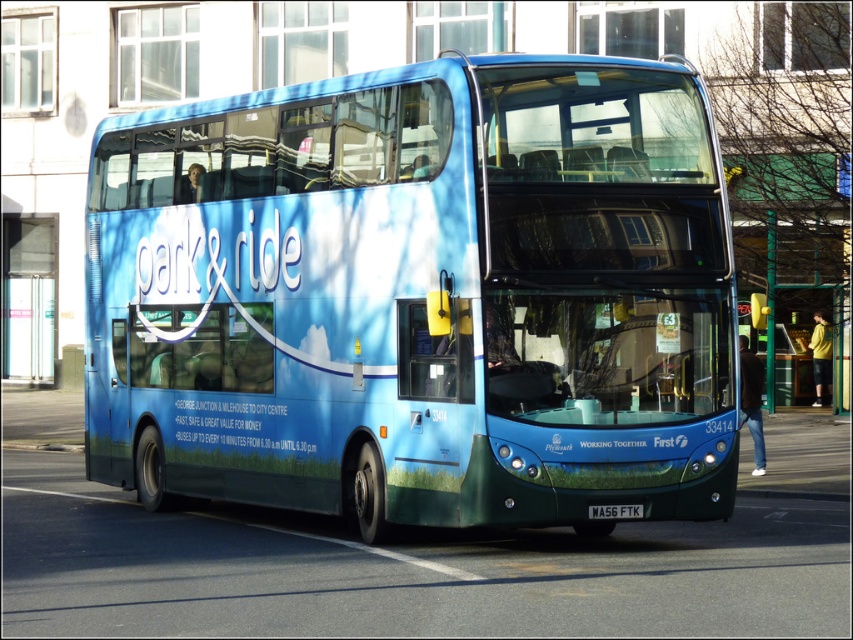
You are a passenger on the blue metallic bus at center and want to read the black plastic license plate at center. Can you see it easily from your seat?

The blue metallic bus at center is taller than the black plastic license plate at center, so it might block your view. You may need to move closer to the front or ask someone to show it to you.

You are a delivery person who needs to load a package onto the back of the blue metallic bus at center. However, there is a black plastic license plate at center in the way. Can you move the license plate to the side to access the loading area?

The blue metallic bus at center is wider than the black plastic license plate at center, so you can move the license plate to the side to access the loading area since the bus is wider.